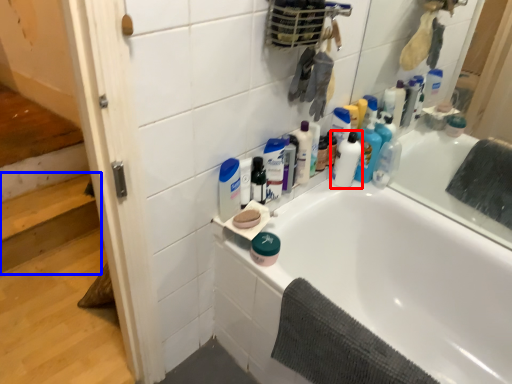
Question: Which point is further to the camera, cleaning product (highlighted by a red box) or stairwell (highlighted by a blue box)?

Choices:
 (A) cleaning product
 (B) stairwell

Answer: (B)